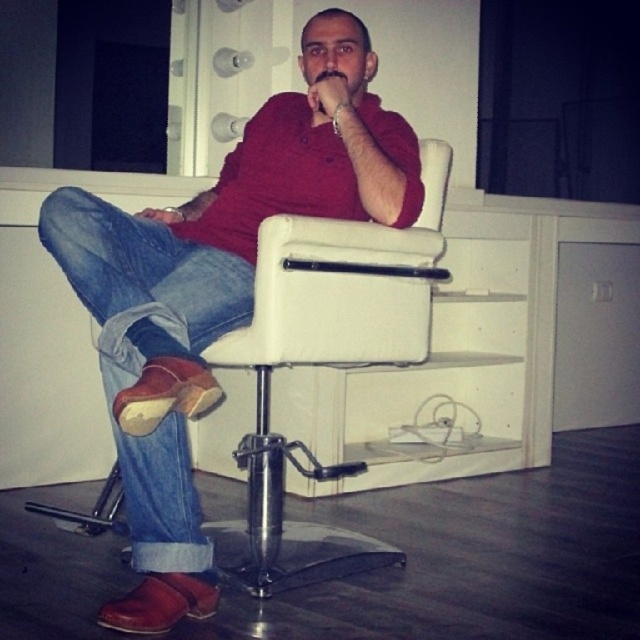
Is suede leather shoes at center positioned before blue denim jeans at lower left?

That is True.

Is suede leather shoes at center smaller than blue denim jeans at lower left?

No.

Is point (193, 544) more distant than point (170, 342)?

That is True.

Identify the location of suede leather shoes at center. (216, 289).